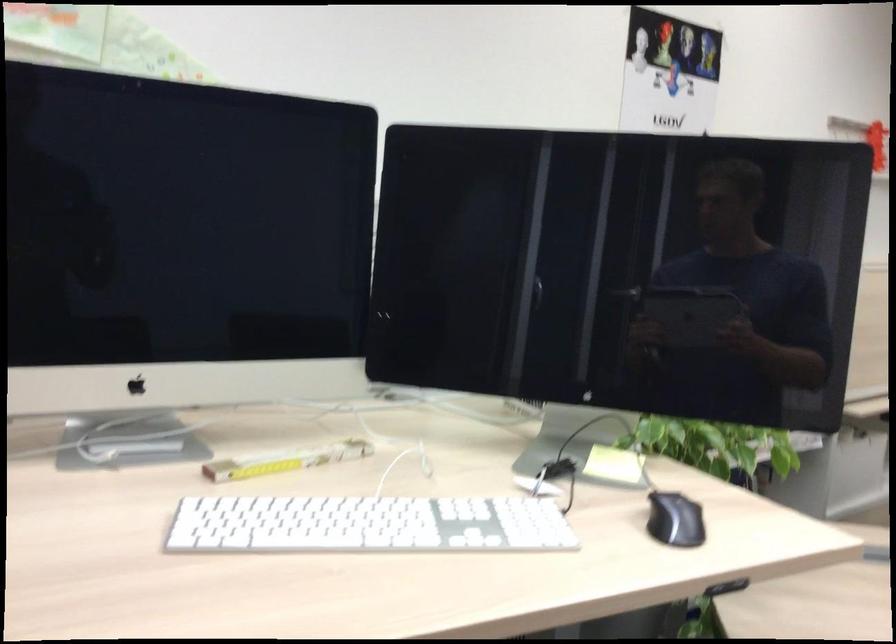
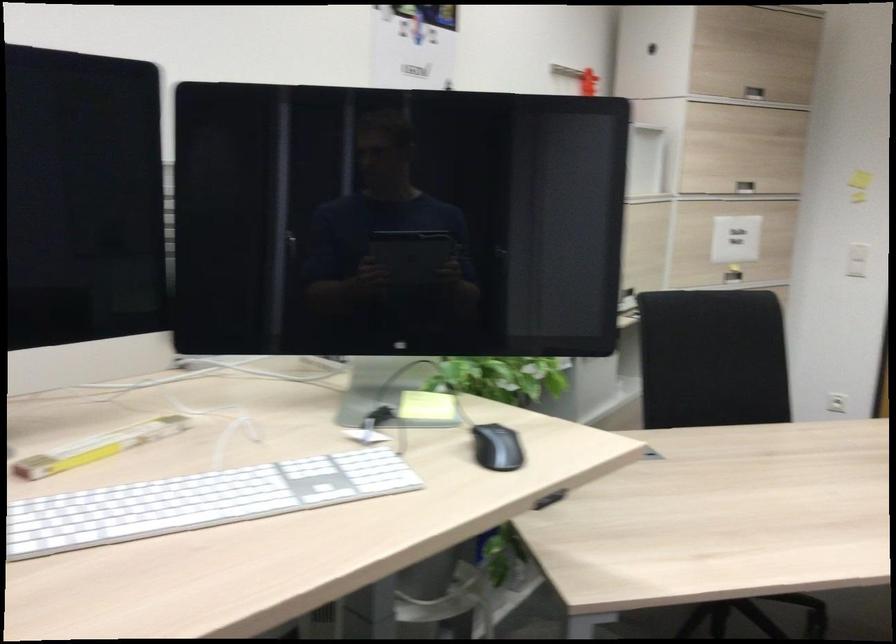
Question: I am providing you with two images of the same scene from different viewpoints. Which of the following objects are not visible in image2?

Choices:
 (A) red wall clamp
 (B) silver cabinet handle
 (C) white computer keyboard
 (D) none of these

Answer: (D)